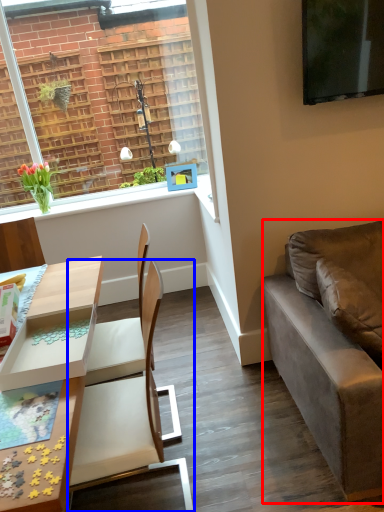
Question: Among these objects, which one is farthest to the camera, studio couch (highlighted by a red box) or chair (highlighted by a blue box)?

Choices:
 (A) studio couch
 (B) chair

Answer: (A)